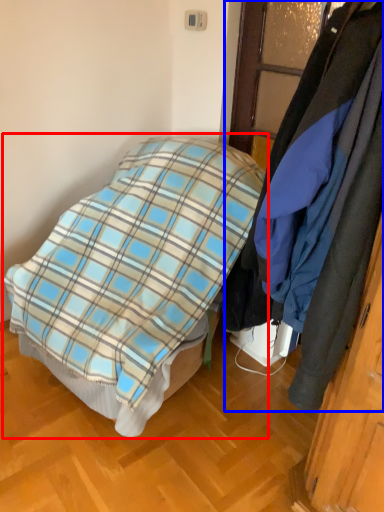
Question: Among these objects, which one is farthest to the camera, bed (highlighted by a red box) or cloak (highlighted by a blue box)?

Choices:
 (A) bed
 (B) cloak

Answer: (A)